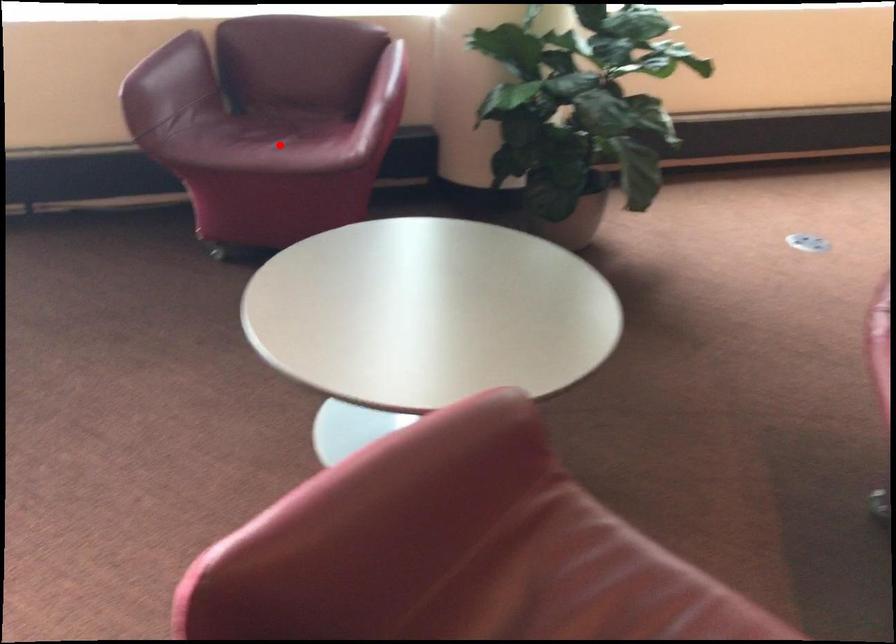
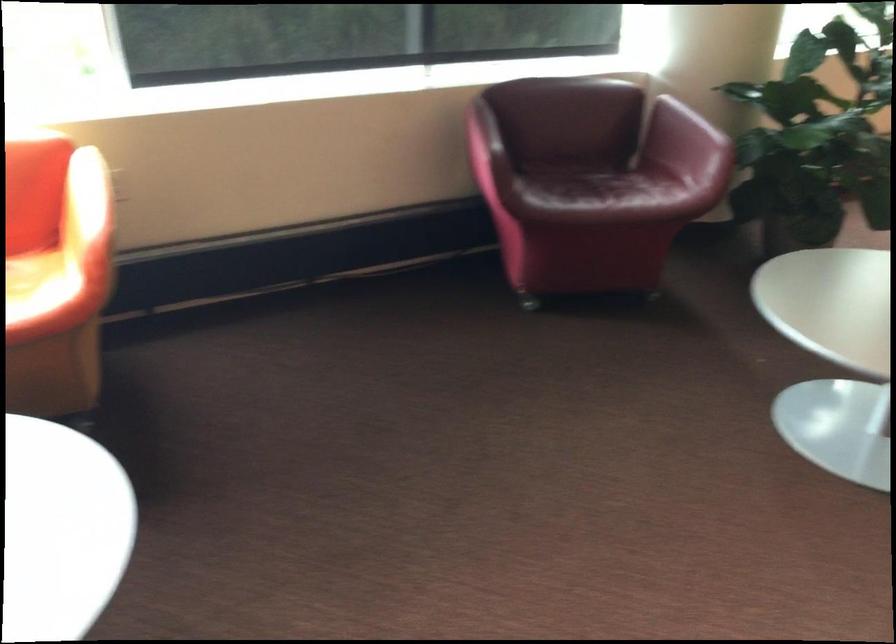
Locate, in the second image, the point that corresponds to the highlighted location in the first image.

(608, 194)